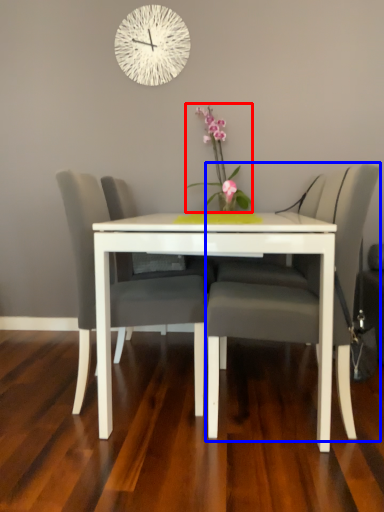
Question: Among these objects, which one is farthest to the camera, floral arrangement (highlighted by a red box) or chair (highlighted by a blue box)?

Choices:
 (A) floral arrangement
 (B) chair

Answer: (A)